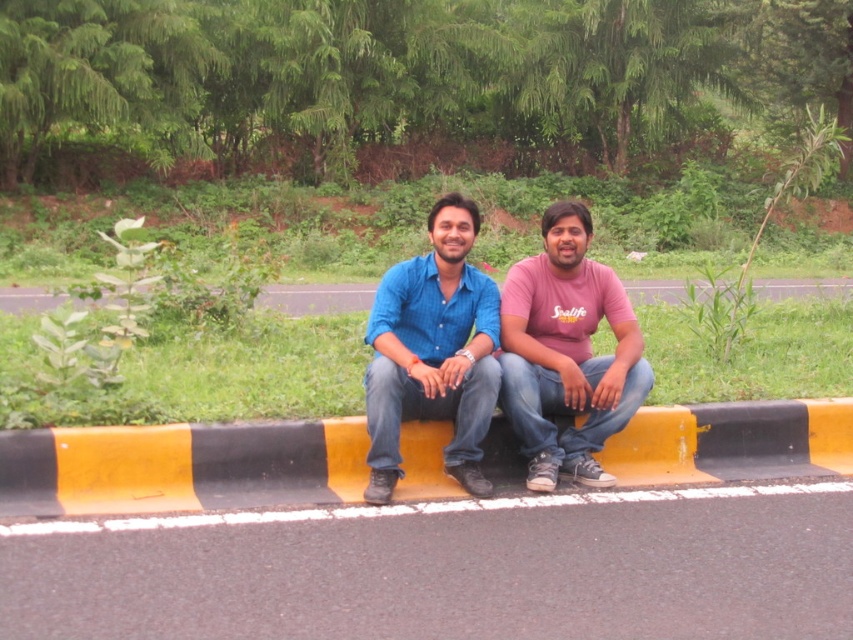
Can you confirm if yellow/black striped curb at center is positioned to the right of blue denim jeans at center?

In fact, yellow/black striped curb at center is to the left of blue denim jeans at center.

Is point (601, 452) farther from viewer compared to point (448, 266)?

Yes, point (601, 452) is behind point (448, 266).

You are a GUI agent. You are given a task and a screenshot of the screen. Output one action in this format:
    pyautogui.click(x=<x>, y=<y>)
    Task: Click on the yellow/black striped curb at center
    Image resolution: width=853 pixels, height=640 pixels.
    Given the screenshot: What is the action you would take?
    point(180,467)

From the picture: Does blue denim jeans at center appear under pink matte shirt at center?

Correct, blue denim jeans at center is located below pink matte shirt at center.

Between blue denim jeans at center and pink matte shirt at center, which one appears on the left side from the viewer's perspective?

From the viewer's perspective, blue denim jeans at center appears more on the left side.

What do you see at coordinates (515, 364) in the screenshot? Image resolution: width=853 pixels, height=640 pixels. I see `blue denim jeans at center` at bounding box center [515, 364].

Identify the location of blue denim jeans at center. (515, 364).

Who is lower down, yellow/black striped curb at center or pink matte shirt at center?

yellow/black striped curb at center is below.

This screenshot has width=853, height=640. What are the coordinates of `yellow/black striped curb at center` in the screenshot? It's located at (180, 467).

The image size is (853, 640). What do you see at coordinates (180, 467) in the screenshot?
I see `yellow/black striped curb at center` at bounding box center [180, 467].

Where is `yellow/black striped curb at center`? yellow/black striped curb at center is located at coordinates (180, 467).